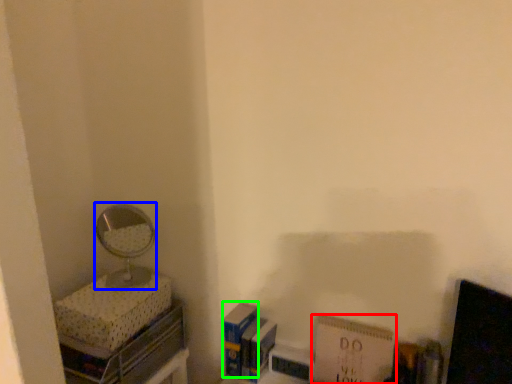
Question: Which is farther away from paperback book (highlighted by a red box)? mirror (highlighted by a blue box) or paperback book (highlighted by a green box)?

Choices:
 (A) mirror
 (B) paperback book

Answer: (A)